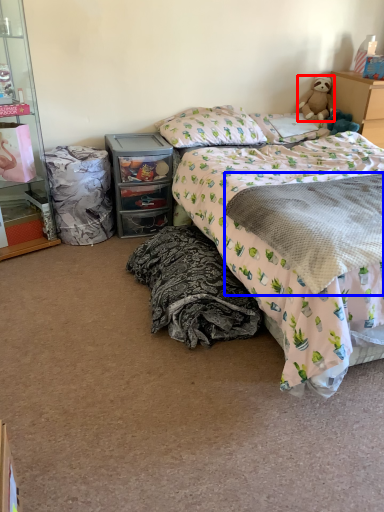
Question: Which object is closer to the camera taking this photo, teddy bear (highlighted by a red box) or blanket (highlighted by a blue box)?

Choices:
 (A) teddy bear
 (B) blanket

Answer: (B)